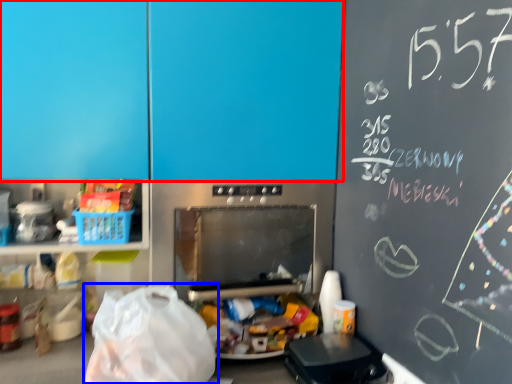
Question: Which object appears farthest to the camera in this image, leftover (highlighted by a red box) or grocery bag (highlighted by a blue box)?

Choices:
 (A) leftover
 (B) grocery bag

Answer: (A)